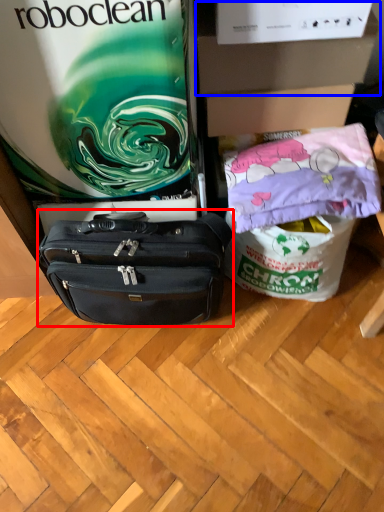
Question: Among these objects, which one is nearest to the camera, luggage and bags (highlighted by a red box) or box (highlighted by a blue box)?

Choices:
 (A) luggage and bags
 (B) box

Answer: (A)